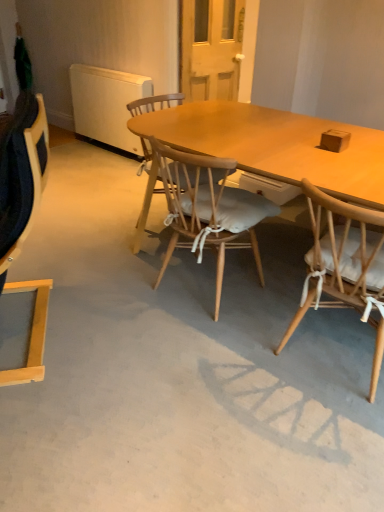
Identify the location of unoccupied area behind light wood chair at left, marked as the third chair in a right-to-left arrangement. (88, 266).